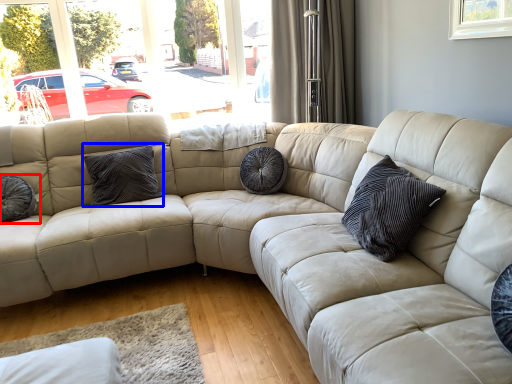
Question: Which object is closer to the camera taking this photo, pillow (highlighted by a red box) or pillow (highlighted by a blue box)?

Choices:
 (A) pillow
 (B) pillow

Answer: (A)